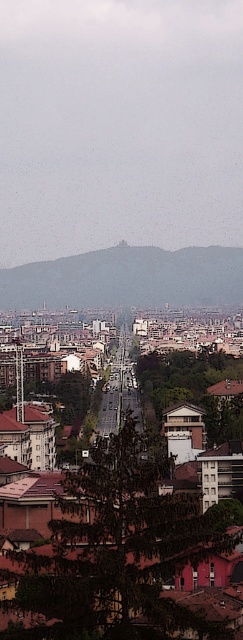
Question: Does brown tiled roofs at center have a lesser width compared to gray stone hillside at center?

Choices:
 (A) yes
 (B) no

Answer: (A)

Question: Which of the following is the closest to the observer?

Choices:
 (A) (11, 577)
 (B) (122, 273)

Answer: (A)

Question: Can you confirm if brown tiled roofs at center is positioned above gray stone hillside at center?

Choices:
 (A) yes
 (B) no

Answer: (B)

Question: Which point is farther from the camera taking this photo?

Choices:
 (A) (132, 630)
 (B) (179, 257)

Answer: (B)

Question: Which point appears farthest from the camera in this image?

Choices:
 (A) (34, 508)
 (B) (150, 300)

Answer: (B)

Question: In this image, where is brown tiled roofs at center located relative to gray stone hillside at center?

Choices:
 (A) left
 (B) right

Answer: (B)